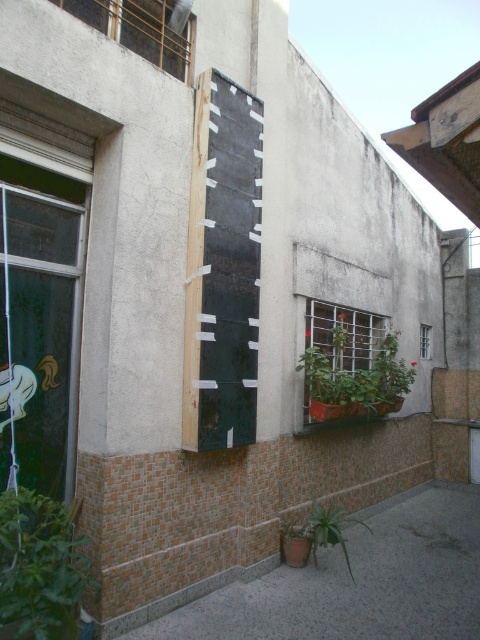
You are a painter standing at the corner of the building. You need to paint the dark green wood at center and the green leafy plant at lower left. If your ladder can reach 2 meters, can you paint both objects without moving the ladder?

The dark green wood at center is 1.79 meters away from the green leafy plant at lower left. Since the distance between them is less than the ladder height of 2 meters, you can paint both objects without moving the ladder.

You are a painter hired to paint the building. You have two items to paint first, the dark green wood at center and the green leafy plant at lower left. Which one should you paint first if you need to start with the larger object?

The dark green wood at center is bigger than the green leafy plant at lower left, so you should paint the dark green wood at center first.